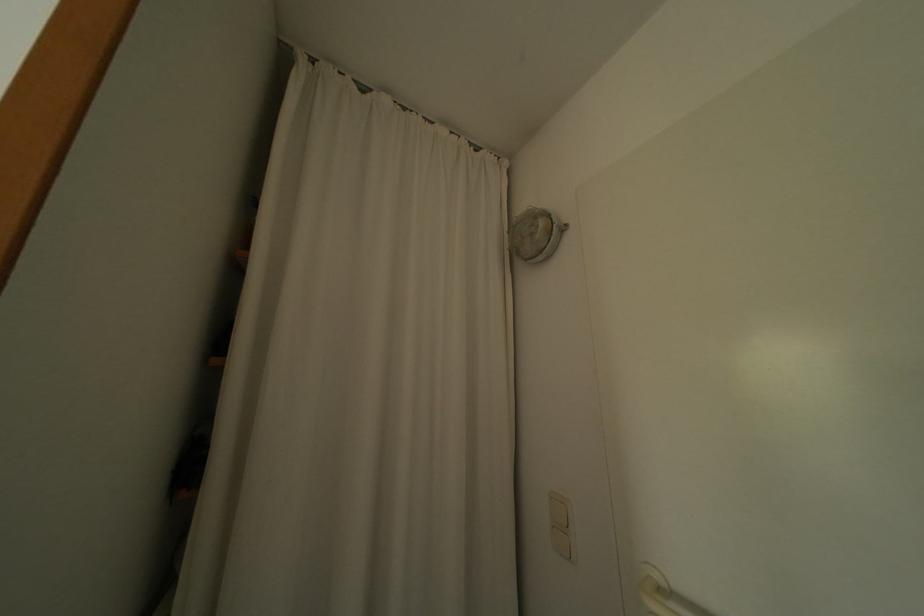
Where would you pull the white door handle? Please return your answer as a coordinate pair (x, y).

(651, 602)